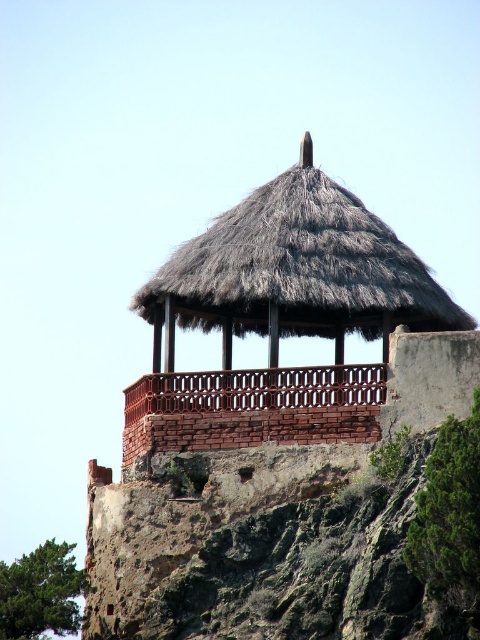
Is thatched wood gazebo at upper center positioned at the back of red brick balcony at upper center?

Yes, thatched wood gazebo at upper center is further from the viewer.

Based on the photo, is thatched wood gazebo at upper center taller than red brick balcony at upper center?

Correct, thatched wood gazebo at upper center is much taller as red brick balcony at upper center.

The width and height of the screenshot is (480, 640). What do you see at coordinates (279, 316) in the screenshot? I see `thatched wood gazebo at upper center` at bounding box center [279, 316].

You are a GUI agent. You are given a task and a screenshot of the screen. Output one action in this format:
    pyautogui.click(x=<x>, y=<y>)
    Task: Click on the thatched wood gazebo at upper center
    This screenshot has height=640, width=480.
    Given the screenshot: What is the action you would take?
    pyautogui.click(x=279, y=316)